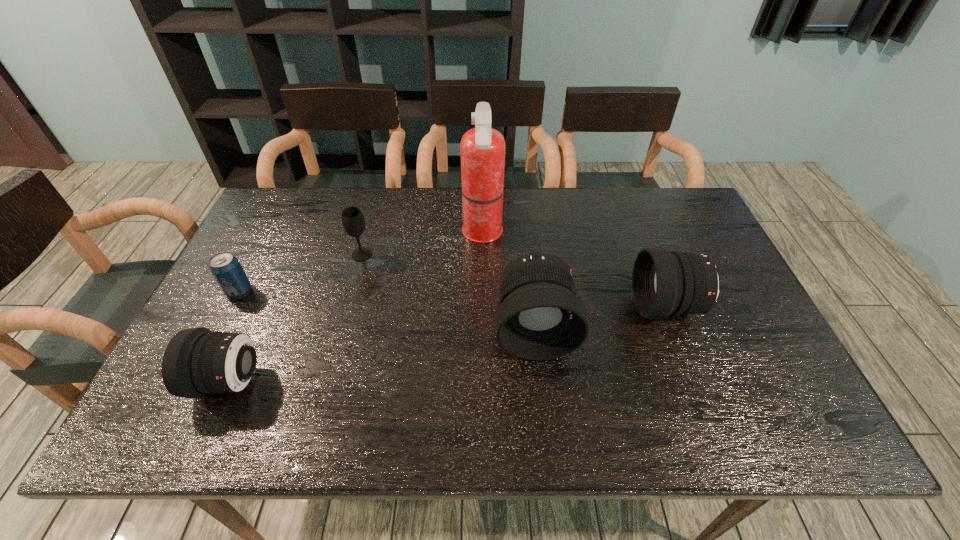
Image resolution: width=960 pixels, height=540 pixels. I want to click on vacant spot for a new telephoto_lens to ensure equal spacing, so click(x=390, y=354).